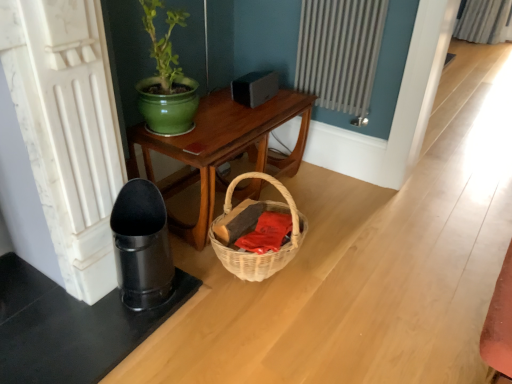
This screenshot has width=512, height=384. Find the location of `woven wood table at center`. woven wood table at center is located at coordinates [222, 148].

Image resolution: width=512 pixels, height=384 pixels. What are the coordinates of `woven wood table at center` in the screenshot? It's located at (222, 148).

Is woven wood table at center at the back of white textured radiator at upper center?

No.

Considering the relative positions of white textured radiator at upper center and woven wood table at center in the image provided, is white textured radiator at upper center in front of woven wood table at center?

No, the depth of white textured radiator at upper center is greater than that of woven wood table at center.

Is woven wood table at center aimed at red cotton cloth at lower center?

Yes, woven wood table at center faces towards red cotton cloth at lower center.

From a real-world perspective, between woven wood table at center and red cotton cloth at lower center, who is vertically lower?

red cotton cloth at lower center.

Between point (220, 158) and point (272, 223), which one is positioned behind?

Point (272, 223)

Do you think woven wood table at center is within red cotton cloth at lower center, or outside of it?

woven wood table at center is outside red cotton cloth at lower center.

How many degrees apart are the facing directions of red cotton cloth at lower center and white textured radiator at upper center?

The facing directions of red cotton cloth at lower center and white textured radiator at upper center are 89 degrees apart.

Is red cotton cloth at lower center surrounding white textured radiator at upper center?

No.

Identify the location of radiator on the right of red cotton cloth at lower center. (340, 53).

From a real-world perspective, is red cotton cloth at lower center positioned under white textured radiator at upper center based on gravity?

Yes, from a real-world perspective, red cotton cloth at lower center is below white textured radiator at upper center.

Where is `houseplant positioned vertically above the woven wood table at center (from a real-world perspective)`? This screenshot has height=384, width=512. houseplant positioned vertically above the woven wood table at center (from a real-world perspective) is located at coordinates (166, 80).

Which is more to the left, woven wood table at center or green ceramic pot at upper center?

green ceramic pot at upper center is more to the left.

Is point (149, 150) positioned after point (192, 111)?

Yes, it is behind point (192, 111).

From a real-world perspective, who is located lower, woven wood table at center or green ceramic pot at upper center?

From a 3D spatial view, woven wood table at center is below.

Is red cotton cloth at lower center turned away from woven wood table at center?

Yes.

Which of these two, red cotton cloth at lower center or woven wood table at center, is wider?

Wider between the two is woven wood table at center.

Considering the positions of point (285, 239) and point (197, 228), is point (285, 239) closer or farther from the camera than point (197, 228)?

Point (285, 239) is positioned closer to the camera compared to point (197, 228).

Consider the image. Is woven wood table at center at the back of green ceramic pot at upper center?

No, green ceramic pot at upper center is not facing the opposite direction of woven wood table at center.

Can you tell me how much green ceramic pot at upper center and woven wood table at center differ in facing direction?

The angle between the facing direction of green ceramic pot at upper center and the facing direction of woven wood table at center is 0.811 degrees.

Does green ceramic pot at upper center have a lesser width compared to woven wood table at center?

Correct, the width of green ceramic pot at upper center is less than that of woven wood table at center.

The width and height of the screenshot is (512, 384). What are the coordinates of `table behind the green ceramic pot at upper center` in the screenshot? It's located at (222, 148).

Considering the relative positions of green ceramic pot at upper center and white textured radiator at upper center in the image provided, is green ceramic pot at upper center to the right of white textured radiator at upper center from the viewer's perspective?

No, green ceramic pot at upper center is not to the right of white textured radiator at upper center.

Considering the sizes of objects green ceramic pot at upper center and white textured radiator at upper center in the image provided, who is wider, green ceramic pot at upper center or white textured radiator at upper center?

With larger width is green ceramic pot at upper center.

Who is shorter, green ceramic pot at upper center or white textured radiator at upper center?

green ceramic pot at upper center is shorter.

Is the depth of green ceramic pot at upper center greater than that of white textured radiator at upper center?

No, it is in front of white textured radiator at upper center.

This screenshot has height=384, width=512. I want to click on radiator located above the woven wood table at center (from the image's perspective), so click(x=340, y=53).

I want to click on table that appears above the red cotton cloth at lower center (from a real-world perspective), so click(222, 148).

Considering their positions, is green ceramic pot at upper center positioned further to woven wood table at center than white textured radiator at upper center?

The object further to woven wood table at center is white textured radiator at upper center.

From the picture: From the image, which object appears to be farther from green ceramic pot at upper center, red cotton cloth at lower center or white textured radiator at upper center?

white textured radiator at upper center lies further to green ceramic pot at upper center than the other object.

Based on their spatial positions, is green ceramic pot at upper center or woven wood table at center further from red cotton cloth at lower center?

The object further to red cotton cloth at lower center is green ceramic pot at upper center.

Based on their spatial positions, is woven wood table at center or red cotton cloth at lower center closer to white textured radiator at upper center?

The object closer to white textured radiator at upper center is woven wood table at center.

Consider the image. Estimate the real-world distances between objects in this image. Which object is closer to woven wood table at center, white textured radiator at upper center or red cotton cloth at lower center?

Based on the image, white textured radiator at upper center appears to be nearer to woven wood table at center.

In the scene shown: From the image, which object appears to be nearer to woven wood table at center, red cotton cloth at lower center or green ceramic pot at upper center?

Based on the image, green ceramic pot at upper center appears to be nearer to woven wood table at center.

Estimate the real-world distances between objects in this image. Which object is closer to red cotton cloth at lower center, woven wood table at center or green ceramic pot at upper center?

Based on the image, woven wood table at center appears to be nearer to red cotton cloth at lower center.

When comparing their distances from white textured radiator at upper center, does green ceramic pot at upper center or woven wood table at center seem closer?

woven wood table at center is positioned closer to the anchor white textured radiator at upper center.

Find the location of a particular element. This screenshot has height=384, width=512. table between white textured radiator at upper center and red cotton cloth at lower center from top to bottom is located at coordinates (222, 148).

Find the location of `table between green ceramic pot at upper center and red cotton cloth at lower center in the vertical direction`. table between green ceramic pot at upper center and red cotton cloth at lower center in the vertical direction is located at coordinates (222, 148).

The width and height of the screenshot is (512, 384). I want to click on table situated between green ceramic pot at upper center and white textured radiator at upper center from left to right, so click(x=222, y=148).

The width and height of the screenshot is (512, 384). Find the location of `houseplant between white textured radiator at upper center and red cotton cloth at lower center in the vertical direction`. houseplant between white textured radiator at upper center and red cotton cloth at lower center in the vertical direction is located at coordinates (166, 80).